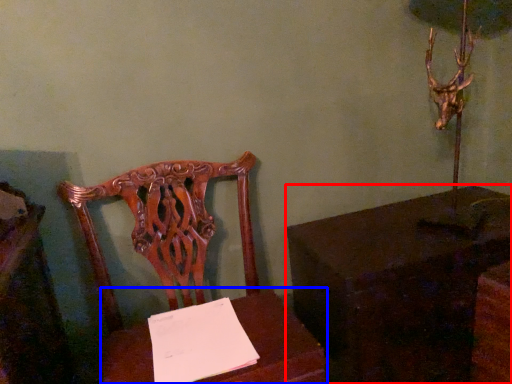
Question: Which point is further to the camera, table (highlighted by a red box) or table (highlighted by a blue box)?

Choices:
 (A) table
 (B) table

Answer: (A)